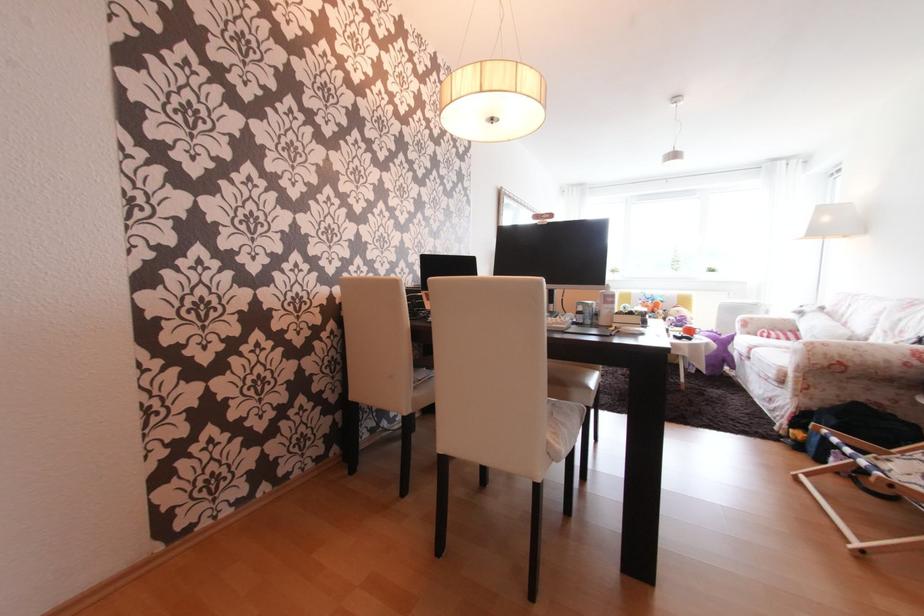
Find where to lift the purple stuffed toy. Please return your answer as a coordinate pair (x, y).

(718, 353)